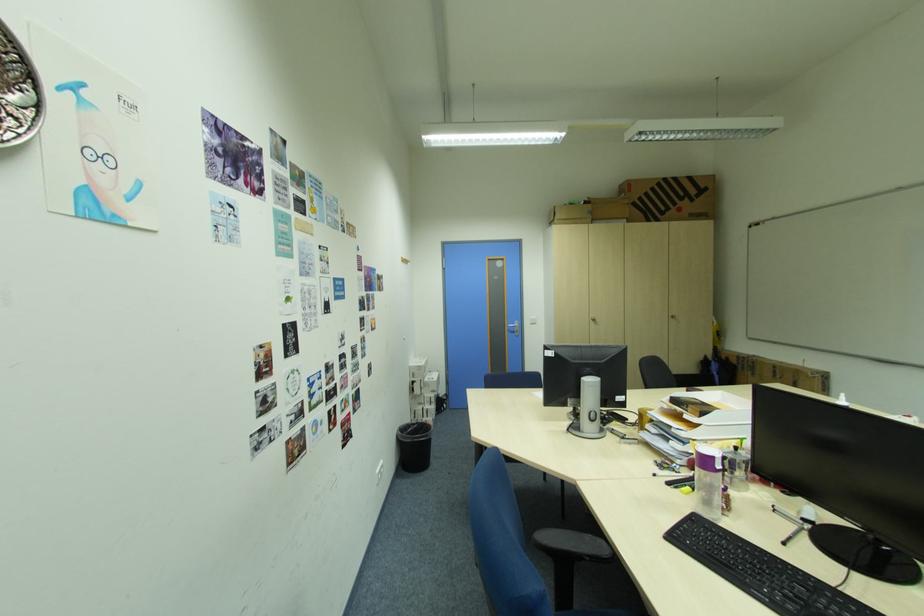
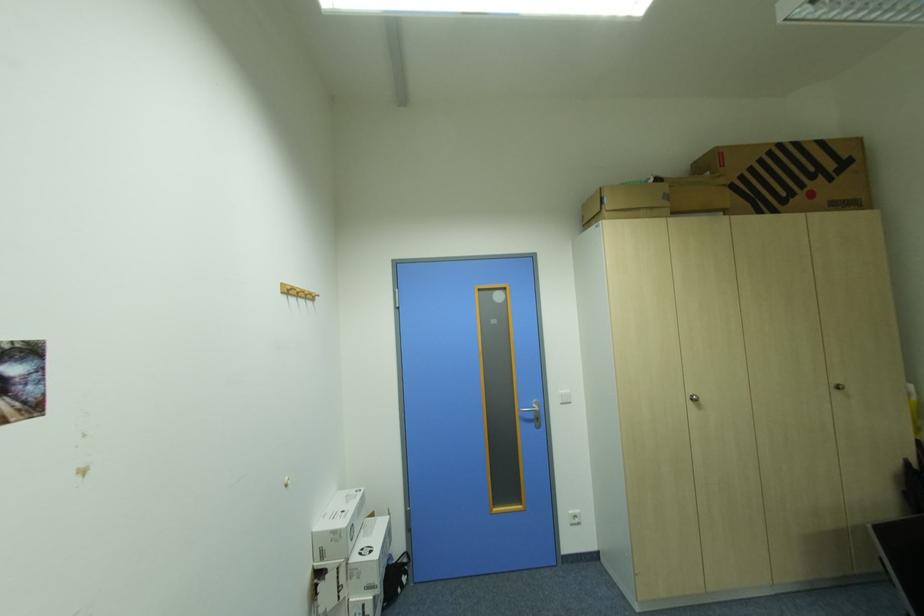
The point at [427,367] is marked in the first image. Where is the corresponding point in the second image?

(341, 533)